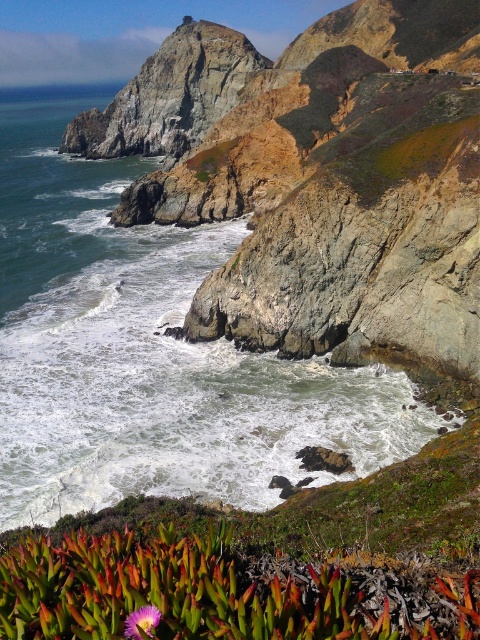
Question: Does foamy white water at center appear on the right side of purple matte flower at lower center?

Choices:
 (A) yes
 (B) no

Answer: (B)

Question: Among these objects, which one is farthest from the camera?

Choices:
 (A) foamy white water at center
 (B) purple matte flower at lower center

Answer: (A)

Question: Which of the following is the closest to the observer?

Choices:
 (A) foamy white water at center
 (B) purple matte flower at lower center

Answer: (B)

Question: Does foamy white water at center appear on the right side of purple matte flower at lower center?

Choices:
 (A) no
 (B) yes

Answer: (A)

Question: Is foamy white water at center wider than purple matte flower at lower center?

Choices:
 (A) yes
 (B) no

Answer: (A)